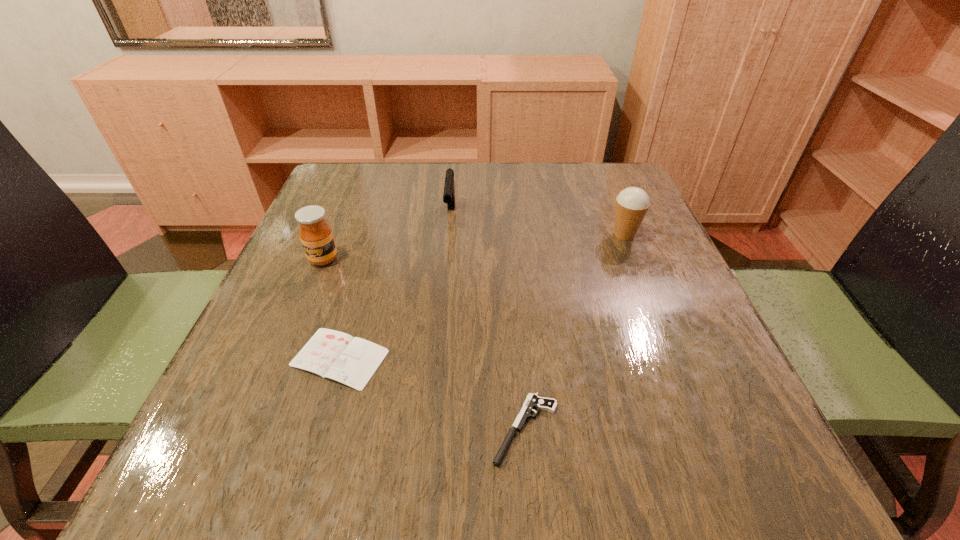
Locate an element on the screen. The height and width of the screenshot is (540, 960). the rightmost object is located at coordinates point(632,203).

What are the coordinates of `honey` in the screenshot? It's located at (316, 235).

Where is `the left pistol`? the left pistol is located at coordinates (449, 188).

Where is `the taller pistol`? The image size is (960, 540). the taller pistol is located at coordinates [x=449, y=188].

The width and height of the screenshot is (960, 540). Identify the location of the nearest object. (532, 401).

This screenshot has width=960, height=540. Find the location of `the right pistol`. the right pistol is located at coordinates (532, 401).

Locate an element on the screen. This screenshot has width=960, height=540. the shortest object is located at coordinates (352, 361).

Find the location of a particular element. This screenshot has width=960, height=540. diary is located at coordinates (352, 361).

At what (x,y) coordinates should I click in order to perform the action: click on vacant space situated 0.310m on the back of the rightmost object. Please return your answer as a coordinate pair (x, y). Looking at the image, I should click on (594, 162).

Locate an element on the screen. This screenshot has width=960, height=540. free space located on the front-facing side of the honey is located at coordinates (260, 414).